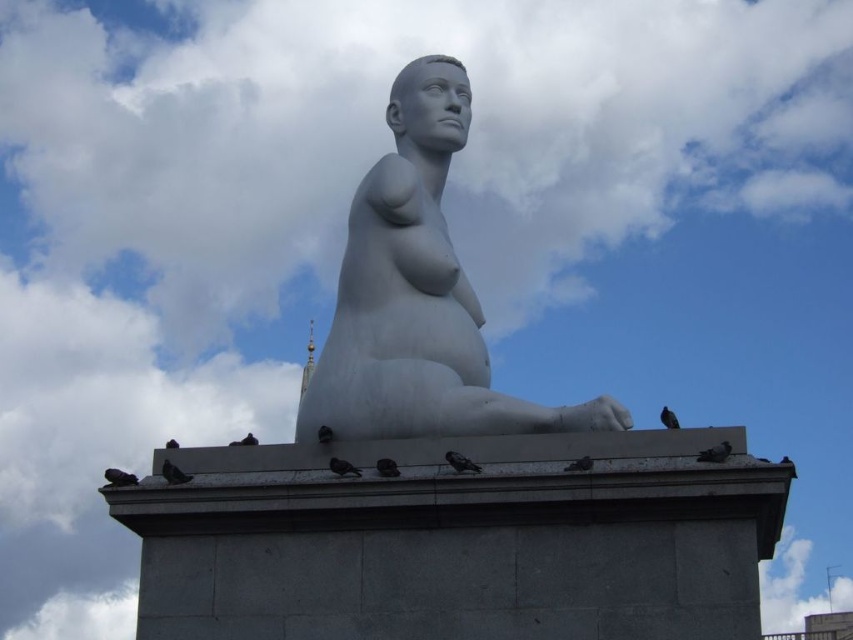
Question: Observing the image, what is the correct spatial positioning of black feathered bird at center in reference to gray matte pigeon at lower center?

Choices:
 (A) below
 (B) above

Answer: (B)

Question: Can you confirm if gray feathered pigeon at lower right is positioned to the left of gray matte bird at center?

Choices:
 (A) yes
 (B) no

Answer: (B)

Question: Is black feathered bird at center below gray matte bird at center?

Choices:
 (A) no
 (B) yes

Answer: (B)

Question: Which point is closer to the camera?

Choices:
 (A) gray feathered pigeon at lower right
 (B) dark gray feathers at lower left
 (C) white marble statue at center
 (D) black matte bird at center

Answer: (A)

Question: Which of the following is the closest to the observer?

Choices:
 (A) (318, 432)
 (B) (672, 419)

Answer: (B)

Question: Considering the real-world distances, which object is farthest from the black feathered bird at center?

Choices:
 (A) dark gray matte bird at lower left
 (B) dark gray feathers at upper center
 (C) gray matte bird at lower center
 (D) dark gray feathers at lower left

Answer: (D)